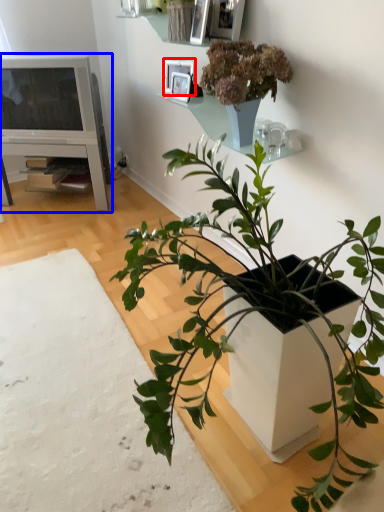
Question: Which object is closer to the camera taking this photo, picture frame (highlighted by a red box) or entertainment center (highlighted by a blue box)?

Choices:
 (A) picture frame
 (B) entertainment center

Answer: (A)